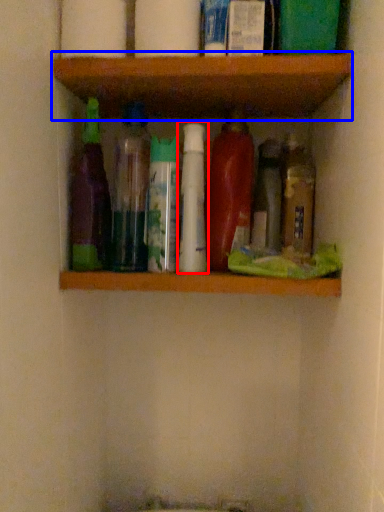
Question: Which object appears closest to the camera in this image, bottle (highlighted by a red box) or shelf (highlighted by a blue box)?

Choices:
 (A) bottle
 (B) shelf

Answer: (B)